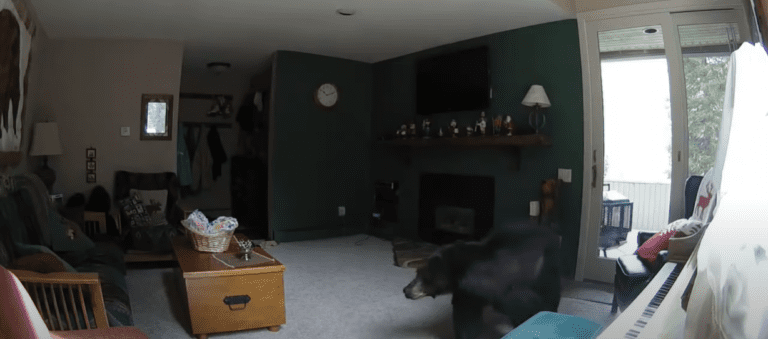
At what (x,y) coordinates should I click in order to perform the action: click on right arm rest of couch. Please return your answer as a coordinate pair (x, y). Looking at the image, I should click on (68, 277).